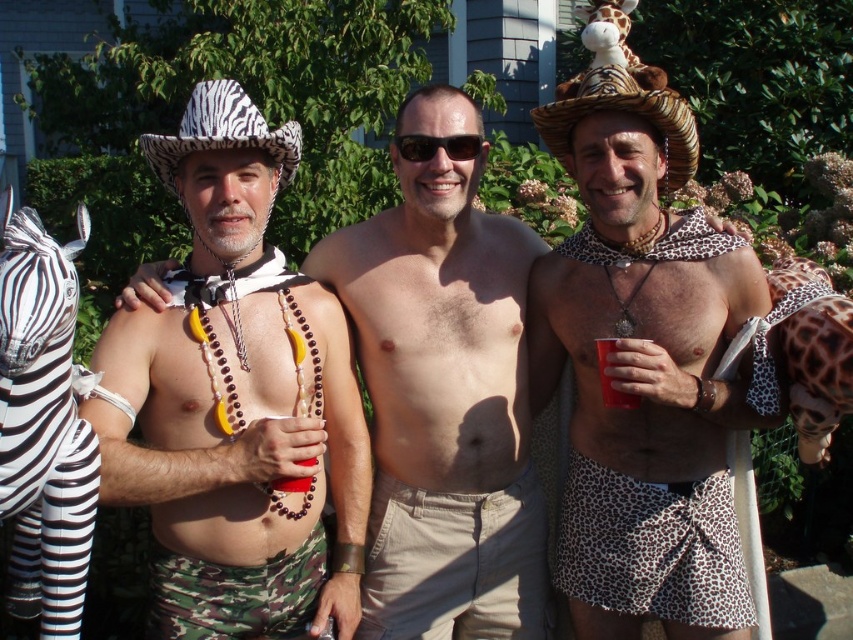
Question: Can you confirm if smooth skin torso at center is positioned below camouflage fabric shorts at center?

Choices:
 (A) yes
 (B) no

Answer: (B)

Question: Which of the following is the closest to the observer?

Choices:
 (A) camouflage fabric shorts at center
 (B) leopard print fabric skirt at center
 (C) red plastic cup at center

Answer: (A)

Question: Is leopard print shorts at center closer to camera compared to black and white striped zebra at left?

Choices:
 (A) yes
 (B) no

Answer: (B)

Question: Estimate the real-world distances between objects in this image. Which object is closer to the black plastic sunglasses at center?

Choices:
 (A) smooth skin torso at center
 (B) black and white striped zebra at left
 (C) red plastic cup at center

Answer: (A)

Question: Is leopard print fabric skirt at center positioned in front of red plastic cup at center?

Choices:
 (A) no
 (B) yes

Answer: (A)

Question: Among these objects, which one is nearest to the camera?

Choices:
 (A) black and white striped zebra at left
 (B) red plastic cup at center

Answer: (A)